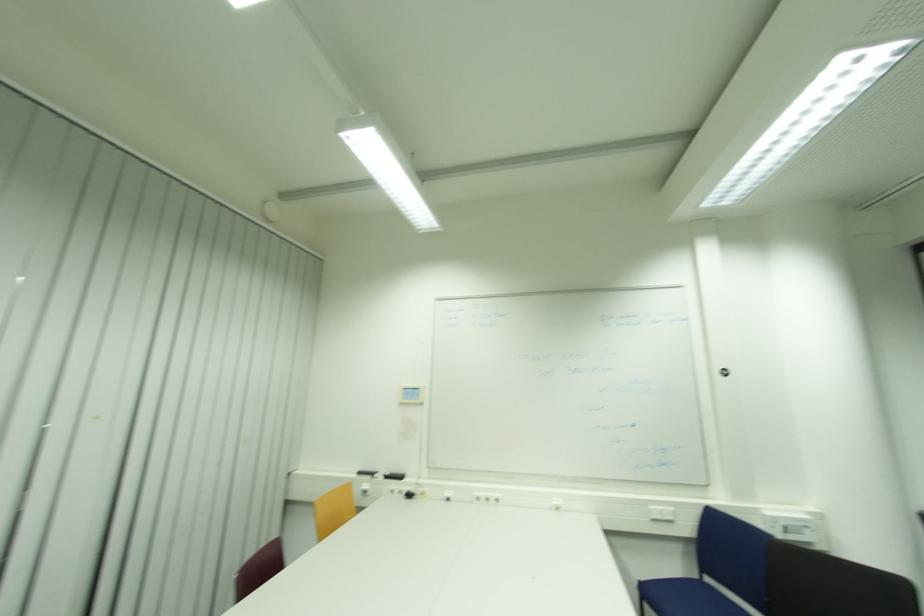
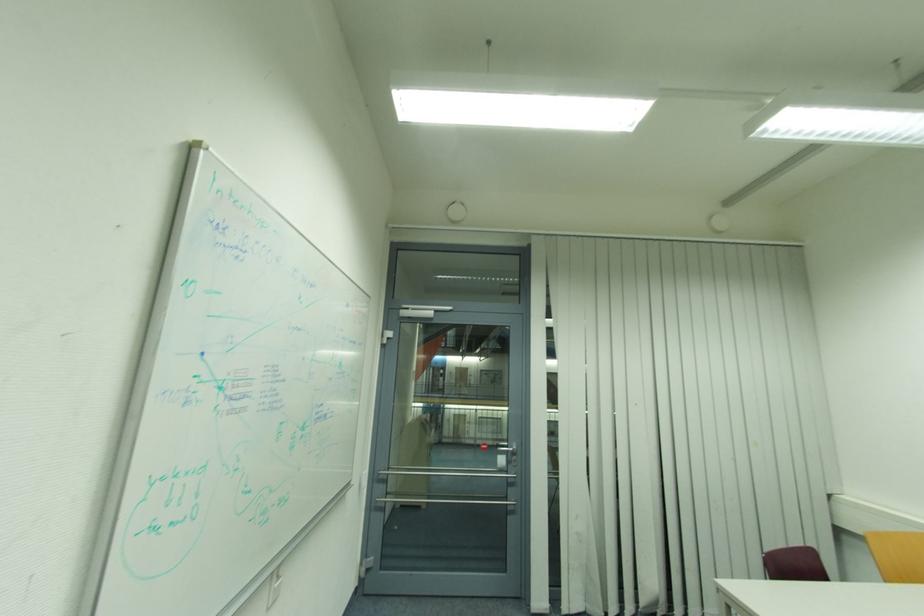
Question: The camera is either moving clockwise (left) or counter-clockwise (right) around the object. The first image is from the beginning of the video and the second image is from the end. Is the camera moving left or right when shooting the video?

Choices:
 (A) Left
 (B) Right

Answer: (B)